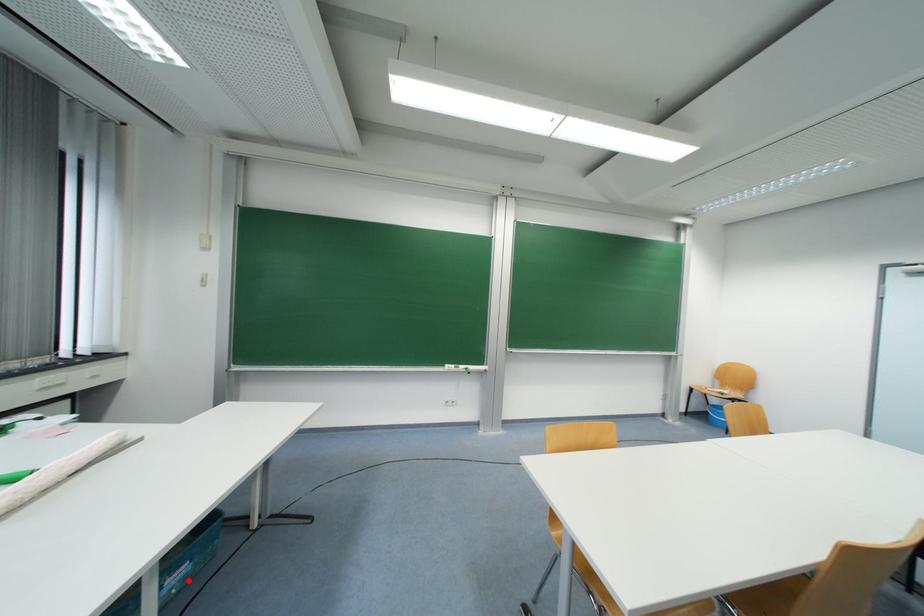
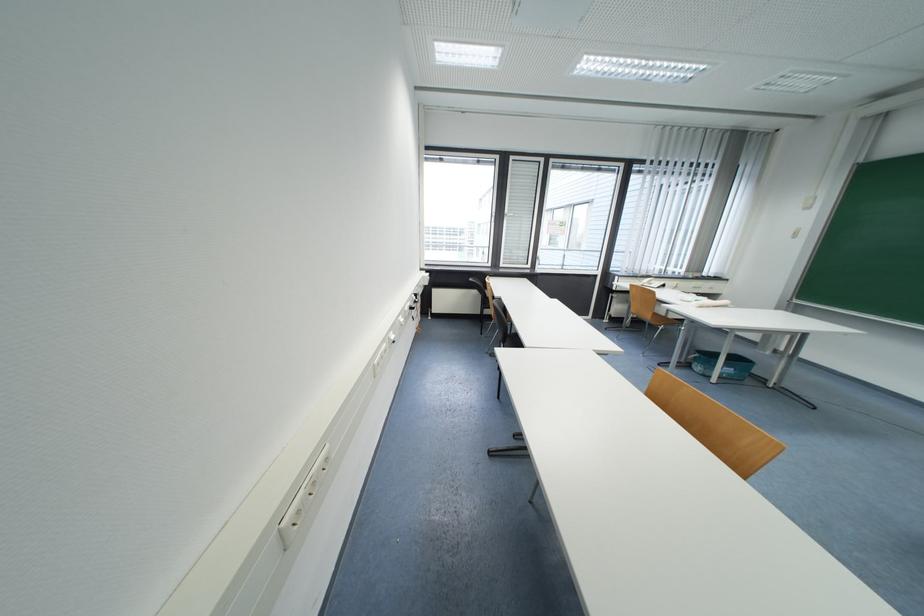
Question: I am providing you with two images of the same scene from different viewpoints. Image1 has a red point marked. In image2, the corresponding 3D location appears at what relative position? Reply with the corresponding letter.

Choices:
 (A) Closer
 (B) Farther

Answer: (B)